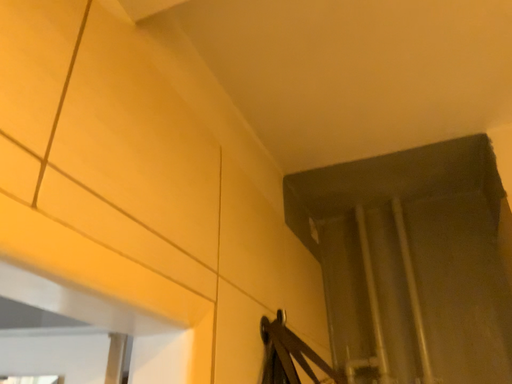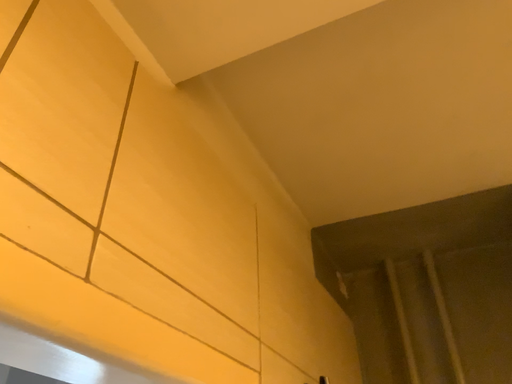
Question: Which way did the camera rotate in the video?

Choices:
 (A) rotated downward
 (B) rotated upward

Answer: (B)